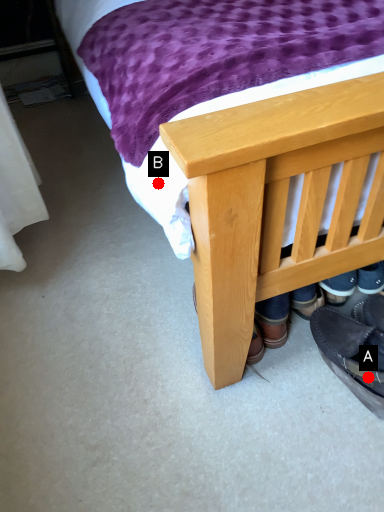
Question: Two points are circled on the image, labeled by A and B beside each circle. Which of the following is the farthest from the observer?

Choices:
 (A) A is further
 (B) B is further

Answer: (A)